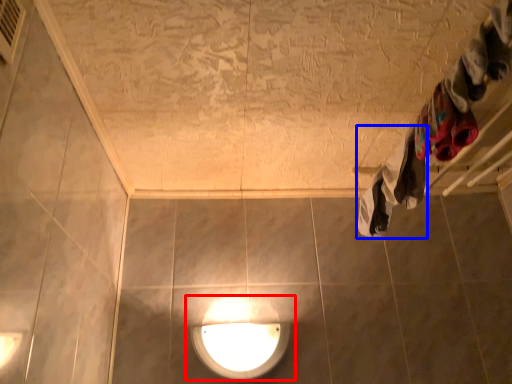
Question: Among these objects, which one is nearest to the camera, lamp (highlighted by a red box) or clothing (highlighted by a blue box)?

Choices:
 (A) lamp
 (B) clothing

Answer: (B)